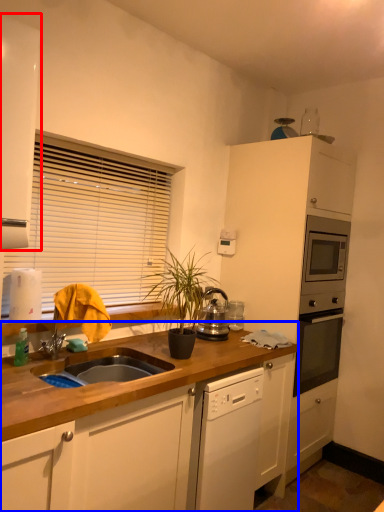
Question: Among these objects, which one is nearest to the camera, cabinetry (highlighted by a red box) or countertop (highlighted by a blue box)?

Choices:
 (A) cabinetry
 (B) countertop

Answer: (B)